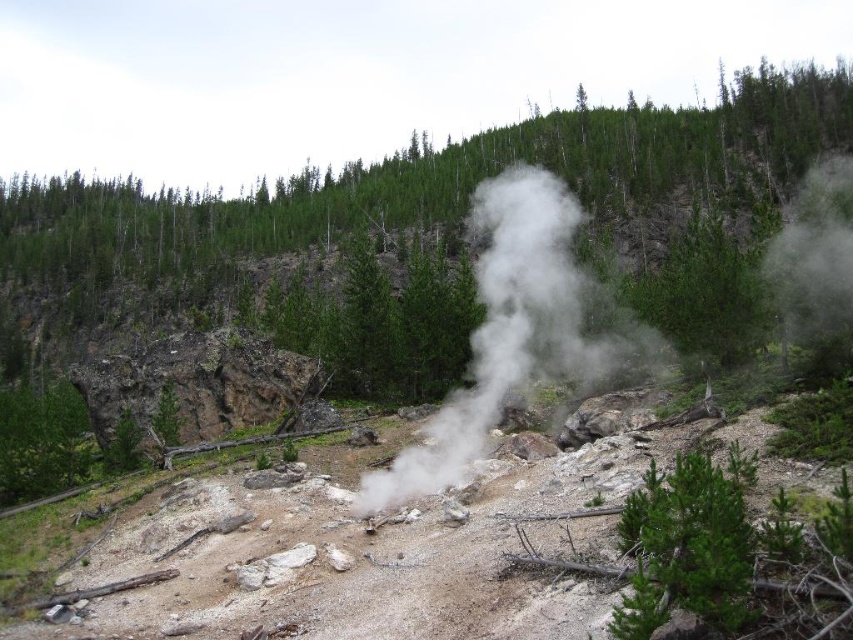
Question: Which point is farther from the camera taking this photo?

Choices:
 (A) (550, 200)
 (B) (703, 365)

Answer: (A)

Question: Is white steam at center wider than green matte tree at center?

Choices:
 (A) yes
 (B) no

Answer: (B)

Question: Observing the image, what is the correct spatial positioning of white steam at center in reference to green matte tree at center?

Choices:
 (A) right
 (B) left

Answer: (B)

Question: Which of the following is the closest to the observer?

Choices:
 (A) (715, 371)
 (B) (537, 236)

Answer: (A)

Question: Is white steam at center below green matte tree at center?

Choices:
 (A) no
 (B) yes

Answer: (A)

Question: Which point appears closest to the camera in this image?

Choices:
 (A) (538, 200)
 (B) (732, 266)

Answer: (B)